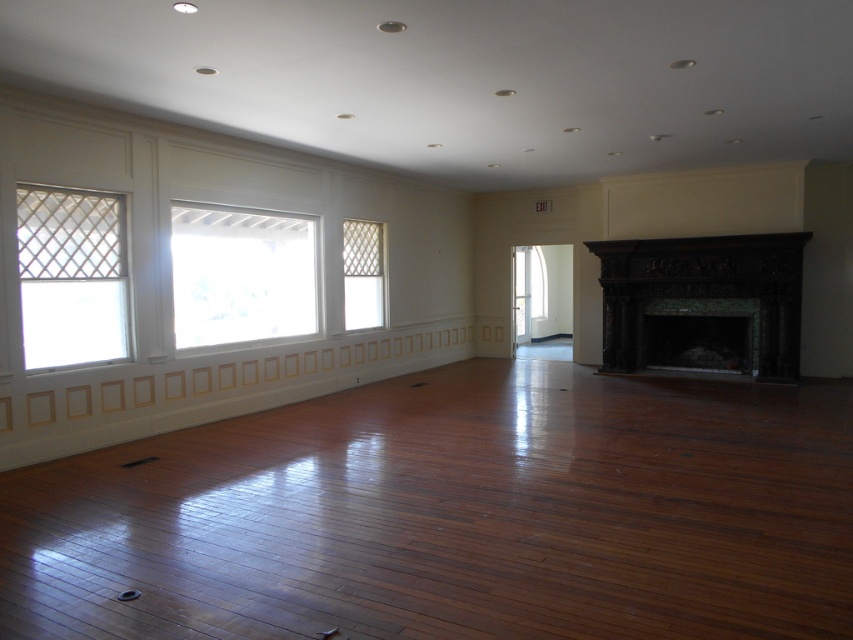
Question: Estimate the real-world distances between objects in this image. Which object is farther from the dark wood fireplace at right?

Choices:
 (A) white lattice window at center
 (B) clear glass window at center

Answer: (B)

Question: Is clear glass window at center to the right of white lattice window at left from the viewer's perspective?

Choices:
 (A) yes
 (B) no

Answer: (A)

Question: Estimate the real-world distances between objects in this image. Which object is closer to the white lattice window at left?

Choices:
 (A) dark wood fireplace at right
 (B) clear glass window at center
 (C) white lattice window at center

Answer: (B)

Question: In this image, where is dark wood fireplace at right located relative to white lattice window at center?

Choices:
 (A) above
 (B) below

Answer: (B)

Question: Does white lattice window at left appear on the left side of white lattice window at center?

Choices:
 (A) yes
 (B) no

Answer: (A)

Question: Which object appears closest to the camera in this image?

Choices:
 (A) white lattice window at left
 (B) dark wood fireplace at right

Answer: (A)